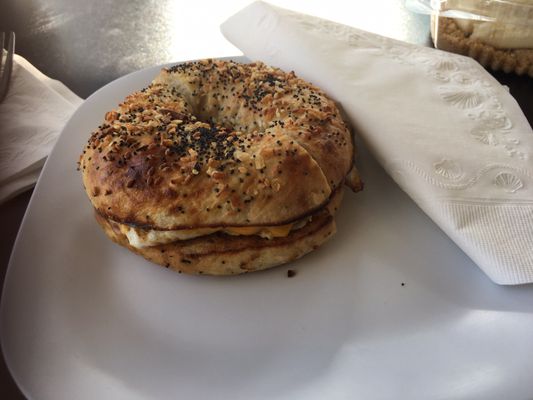
Locate an element on the screen. table is located at coordinates click(x=133, y=40).